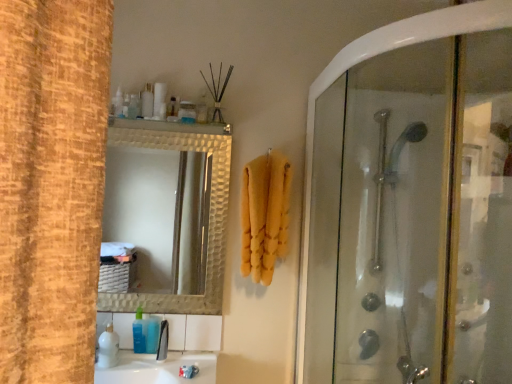
Question: Is yellow fluffy towel at center smaller than white glossy sink at lower center?

Choices:
 (A) no
 (B) yes

Answer: (B)

Question: Considering the relative positions of yellow fluffy towel at center and white glossy sink at lower center in the image provided, is yellow fluffy towel at center to the left of white glossy sink at lower center from the viewer's perspective?

Choices:
 (A) yes
 (B) no

Answer: (B)

Question: Is yellow fluffy towel at center positioned with its back to white glossy sink at lower center?

Choices:
 (A) no
 (B) yes

Answer: (A)

Question: From the image's perspective, is yellow fluffy towel at center beneath white glossy sink at lower center?

Choices:
 (A) yes
 (B) no

Answer: (B)

Question: Is yellow fluffy towel at center positioned before white glossy sink at lower center?

Choices:
 (A) no
 (B) yes

Answer: (A)

Question: Is yellow fluffy towel at center thinner than white glossy sink at lower center?

Choices:
 (A) yes
 (B) no

Answer: (A)

Question: From the image's perspective, is yellow fluffy towel at center located above transparent glass shower door at right?

Choices:
 (A) no
 (B) yes

Answer: (B)

Question: Can you confirm if yellow fluffy towel at center is shorter than transparent glass shower door at right?

Choices:
 (A) yes
 (B) no

Answer: (A)

Question: From the image's perspective, is yellow fluffy towel at center under transparent glass shower door at right?

Choices:
 (A) no
 (B) yes

Answer: (A)

Question: From a real-world perspective, is yellow fluffy towel at center below transparent glass shower door at right?

Choices:
 (A) no
 (B) yes

Answer: (A)

Question: Does yellow fluffy towel at center have a larger size compared to transparent glass shower door at right?

Choices:
 (A) no
 (B) yes

Answer: (A)

Question: Could transparent glass shower door at right be considered to be inside yellow fluffy towel at center?

Choices:
 (A) no
 (B) yes

Answer: (A)

Question: From a real-world perspective, is white glossy soap at upper center, which is counted as the 2th toiletry, starting from the left, physically above black plastic faucet at lower center?

Choices:
 (A) no
 (B) yes

Answer: (B)